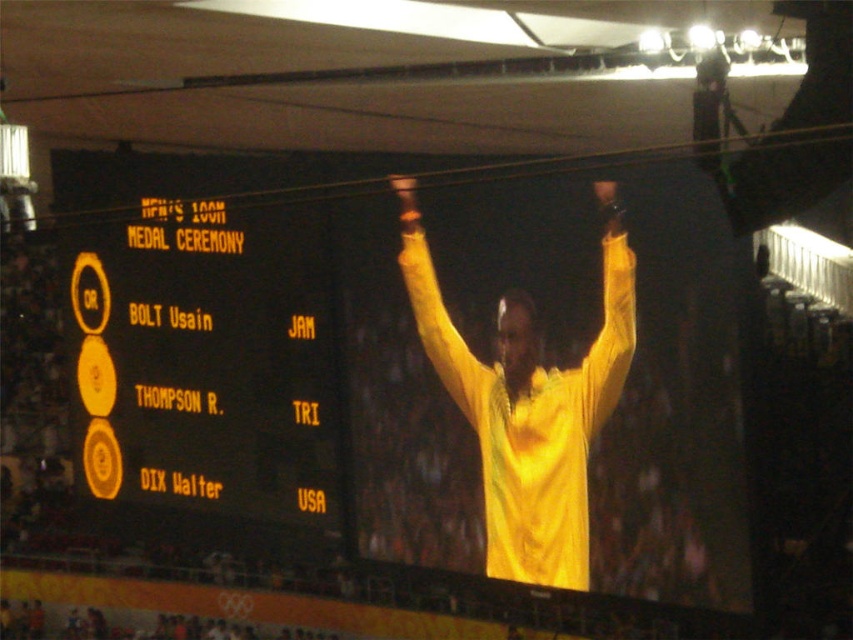
You are an event organizer who needs to hang a banner between the yellow fabric arm at center and the yellow fabric arm at upper center. Which arm should you attach the banner to if you want it to be closer to the top of the frame?

The yellow fabric arm at upper center is positioned higher up in the frame, so attaching the banner to it will place it closer to the top of the frame.

You are an athlete standing at the center of the medal ceremony. You see the yellow fabric arm at center and the yellow fabric arm at upper center. Which one is closer to you?

The yellow fabric arm at center is closer to you than the yellow fabric arm at upper center because it is further to the viewer.

You are a photographer at the medal ceremony. You need to capture a photo where both the yellow matte scoreboard at upper center and the yellow fabric arm at upper center are visible. Which object should be placed higher in the frame to ensure both are in the shot?

The yellow fabric arm at upper center should be placed higher in the frame since the yellow matte scoreboard at upper center is positioned below it, allowing both to be captured when the fabric arm is higher.